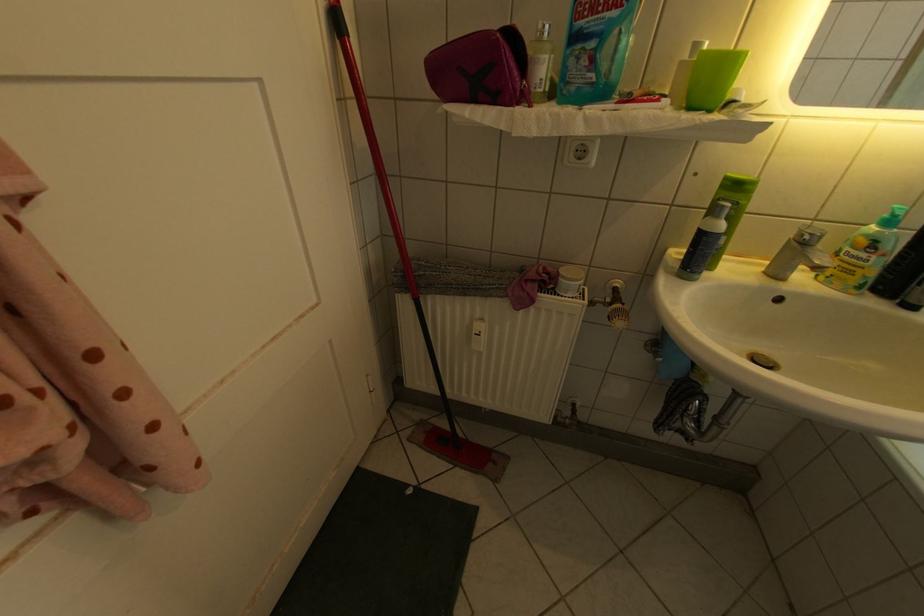
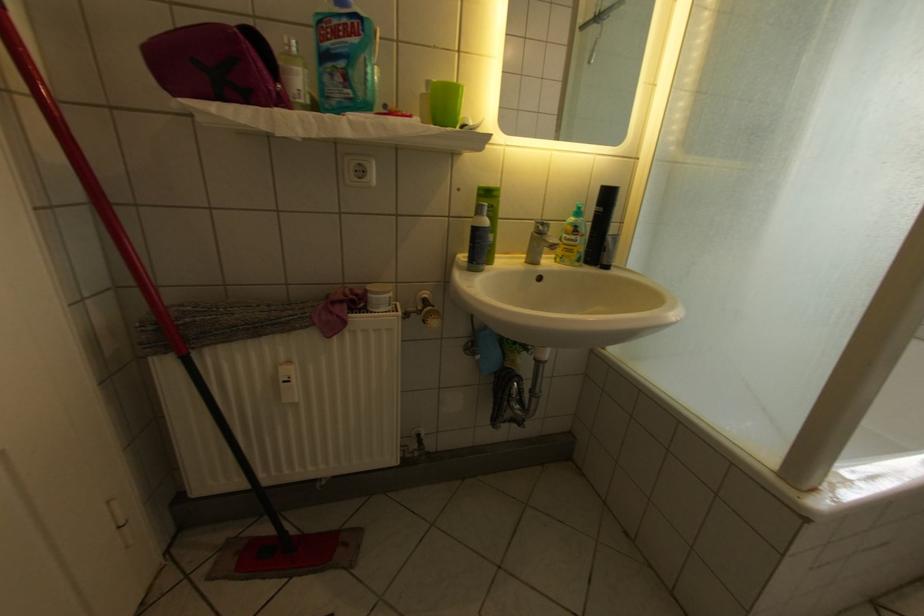
Find the pixel in the second image that matches point (511, 37) in the first image.

(247, 30)